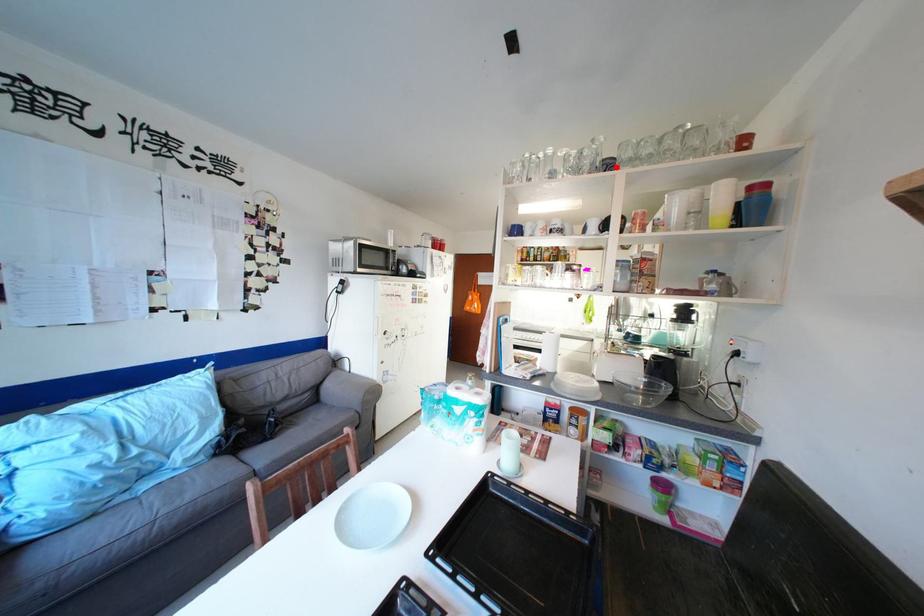
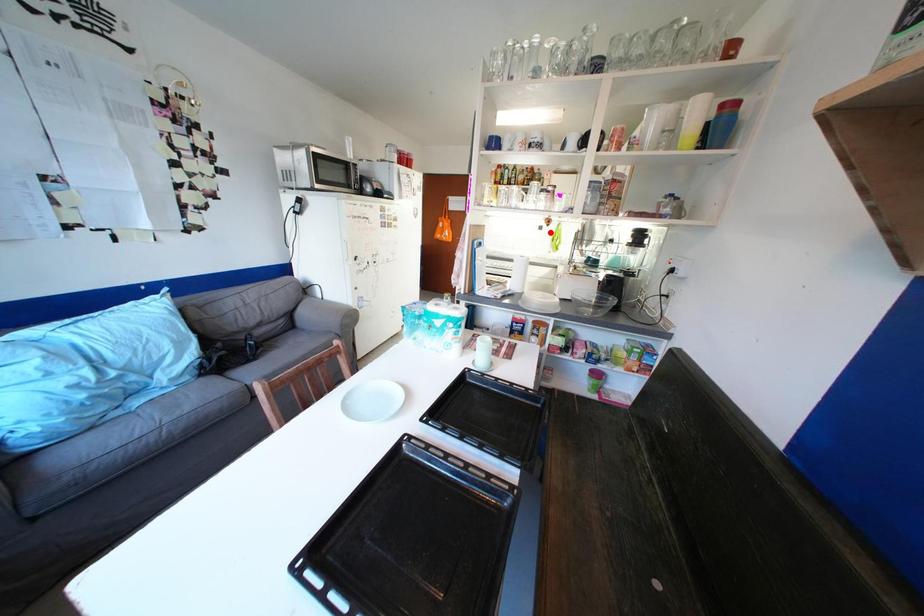
I am providing you with two images of the same scene from different viewpoints. A red point is marked on the first image and another point is marked on the second image. Are the points marked in image1 and image2 representing the same 3D position?

No